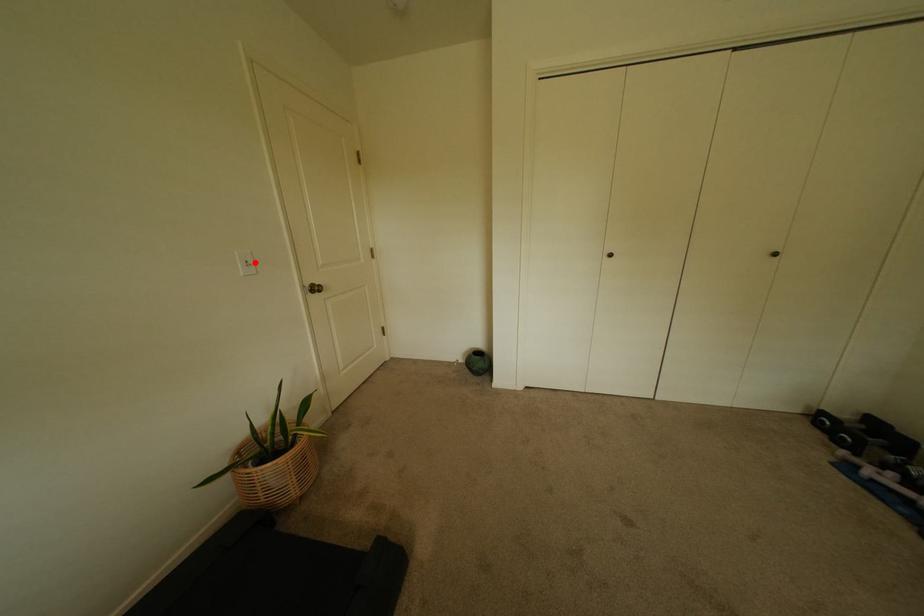
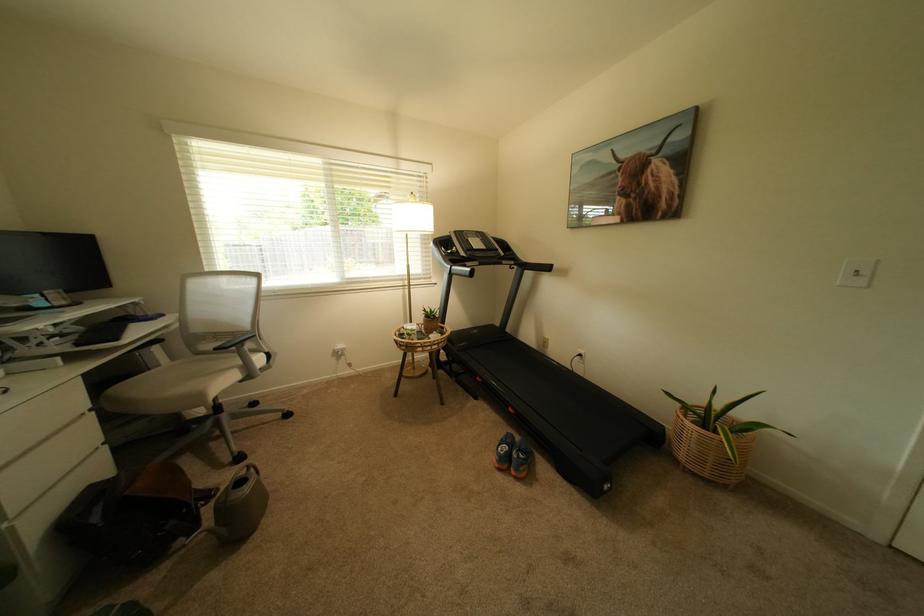
Locate, in the second image, the point that corresponds to the highlighted location in the first image.

(866, 272)